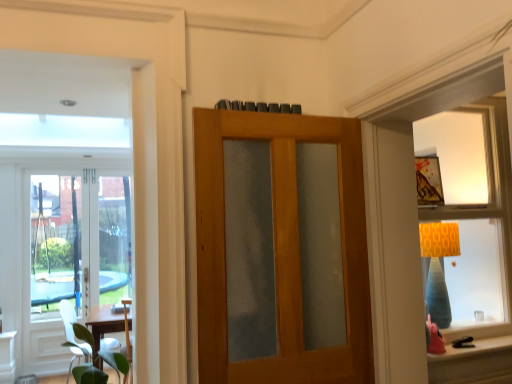
Question: Considering the relative positions of wooden door with frosted glass at center, positioned as the 2th door in left-to-right order, and matte orange lampshade at upper right in the image provided, is wooden door with frosted glass at center, positioned as the 2th door in left-to-right order, in front of matte orange lampshade at upper right?

Choices:
 (A) yes
 (B) no

Answer: (A)

Question: Is wooden door with frosted glass at center, the first door viewed from the front, to the left of matte orange lampshade at upper right from the viewer's perspective?

Choices:
 (A) yes
 (B) no

Answer: (A)

Question: Is wooden door with frosted glass at center, which ranks as the second door in back-to-front order, positioned far away from matte orange lampshade at upper right?

Choices:
 (A) no
 (B) yes

Answer: (B)

Question: Does wooden door with frosted glass at center, the first door positioned from the right, have a lesser height compared to matte orange lampshade at upper right?

Choices:
 (A) yes
 (B) no

Answer: (A)

Question: From the image's perspective, would you say wooden door with frosted glass at center, the first door viewed from the front, is shown under matte orange lampshade at upper right?

Choices:
 (A) yes
 (B) no

Answer: (A)

Question: Considering their positions, is clear glass door at left, which ranks as the 2th door in front-to-back order, located in front of or behind matte orange lampshade at upper right?

Choices:
 (A) behind
 (B) front

Answer: (A)

Question: Is clear glass door at left, the 1th door from the back, wider or thinner than matte orange lampshade at upper right?

Choices:
 (A) thin
 (B) wide

Answer: (A)

Question: Considering the positions of clear glass door at left, which ranks as the 1th door in left-to-right order, and matte orange lampshade at upper right in the image, is clear glass door at left, which ranks as the 1th door in left-to-right order, bigger or smaller than matte orange lampshade at upper right?

Choices:
 (A) small
 (B) big

Answer: (A)

Question: From their relative heights in the image, would you say clear glass door at left, which ranks as the 1th door in left-to-right order, is taller or shorter than matte orange lampshade at upper right?

Choices:
 (A) short
 (B) tall

Answer: (B)

Question: In terms of height, does clear glass door at left, the 1th door from the back, look taller or shorter compared to wooden door with frosted glass at center, the first door positioned from the right?

Choices:
 (A) tall
 (B) short

Answer: (A)

Question: From the image's perspective, is clear glass door at left, arranged as the second door when viewed from the right, located above or below wooden door with frosted glass at center, the first door viewed from the front?

Choices:
 (A) below
 (B) above

Answer: (A)

Question: In terms of size, does clear glass door at left, which ranks as the 1th door in left-to-right order, appear bigger or smaller than wooden door with frosted glass at center, which ranks as the second door in back-to-front order?

Choices:
 (A) small
 (B) big

Answer: (A)

Question: Considering the positions of clear glass door at left, which ranks as the 2th door in front-to-back order, and wooden door with frosted glass at center, the first door positioned from the right, in the image, is clear glass door at left, which ranks as the 2th door in front-to-back order, wider or thinner than wooden door with frosted glass at center, the first door positioned from the right,?

Choices:
 (A) wide
 (B) thin

Answer: (B)

Question: In terms of width, does clear glass door at left, arranged as the second door when viewed from the right, look wider or thinner when compared to white matte chair at lower left?

Choices:
 (A) thin
 (B) wide

Answer: (A)

Question: Considering the positions of clear glass door at left, the 1th door from the back, and white matte chair at lower left in the image, is clear glass door at left, the 1th door from the back, taller or shorter than white matte chair at lower left?

Choices:
 (A) short
 (B) tall

Answer: (B)